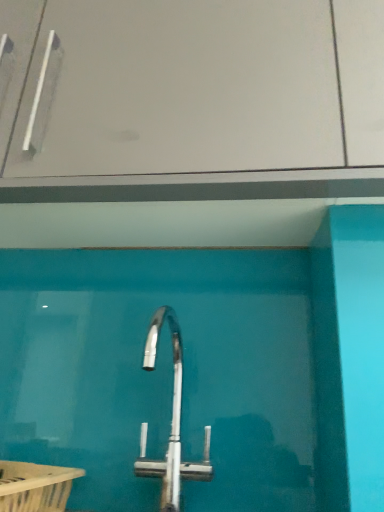
Question: Is white plastic bath at lower left bigger or smaller than transparent glass door at center?

Choices:
 (A) small
 (B) big

Answer: (A)

Question: Does point 11,506 appear closer or farther from the camera than point 286,14?

Choices:
 (A) farther
 (B) closer

Answer: (B)

Question: Which object is the closest to the transparent glass door at center?

Choices:
 (A) white plastic bath at lower left
 (B) polished chrome tap at center

Answer: (B)

Question: Which of these objects is positioned farthest from the white plastic bath at lower left?

Choices:
 (A) transparent glass door at center
 (B) polished chrome tap at center

Answer: (A)